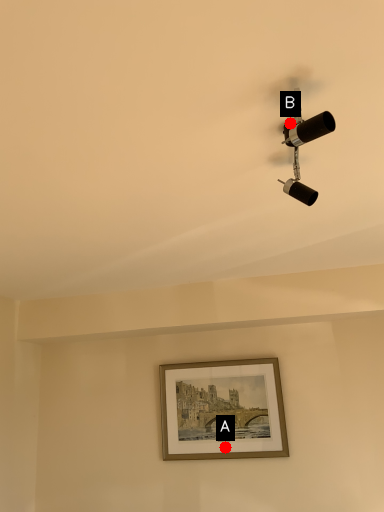
Question: Two points are circled on the image, labeled by A and B beside each circle. Which of the following is the closest to the observer?

Choices:
 (A) A is closer
 (B) B is closer

Answer: (B)